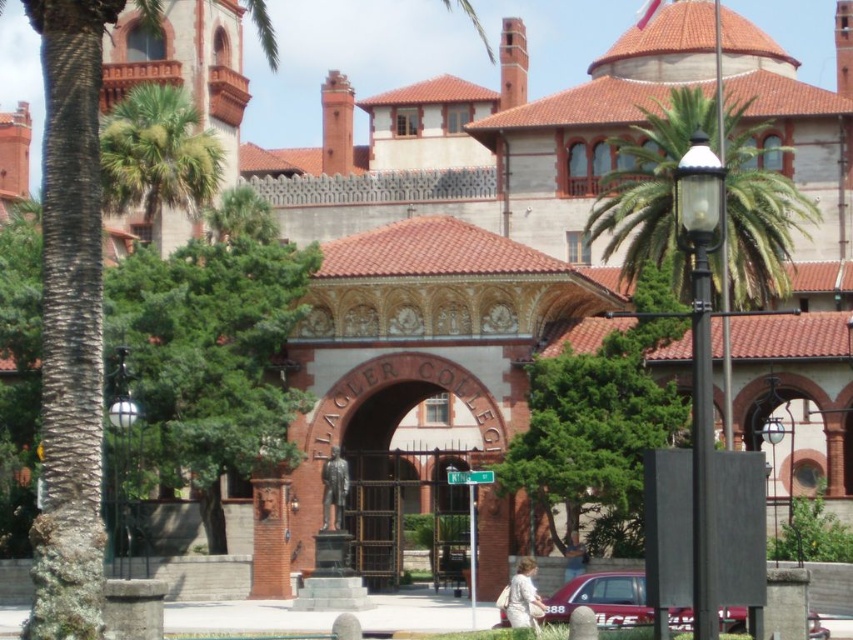
Question: Which point is closer to the camera?

Choices:
 (A) green leafy palm tree at upper left
 (B) green leafy palm at upper right

Answer: (B)

Question: Which object is closer to the camera taking this photo?

Choices:
 (A) green leafy palm tree at upper left
 (B) metallic red car at lower center
 (C) green leafy palm at upper right

Answer: (C)

Question: Can you confirm if green leafy palm at upper right is positioned below metallic red car at lower center?

Choices:
 (A) no
 (B) yes

Answer: (A)

Question: Considering the real-world distances, which object is farthest from the green leafy palm at upper right?

Choices:
 (A) green leafy palm tree at upper left
 (B) metallic red car at lower center

Answer: (B)

Question: Does green leafy palm tree at upper left have a lesser width compared to metallic red car at lower center?

Choices:
 (A) no
 (B) yes

Answer: (A)

Question: From the image, what is the correct spatial relationship of green leafy palm tree at upper left in relation to metallic red car at lower center?

Choices:
 (A) left
 (B) right

Answer: (A)